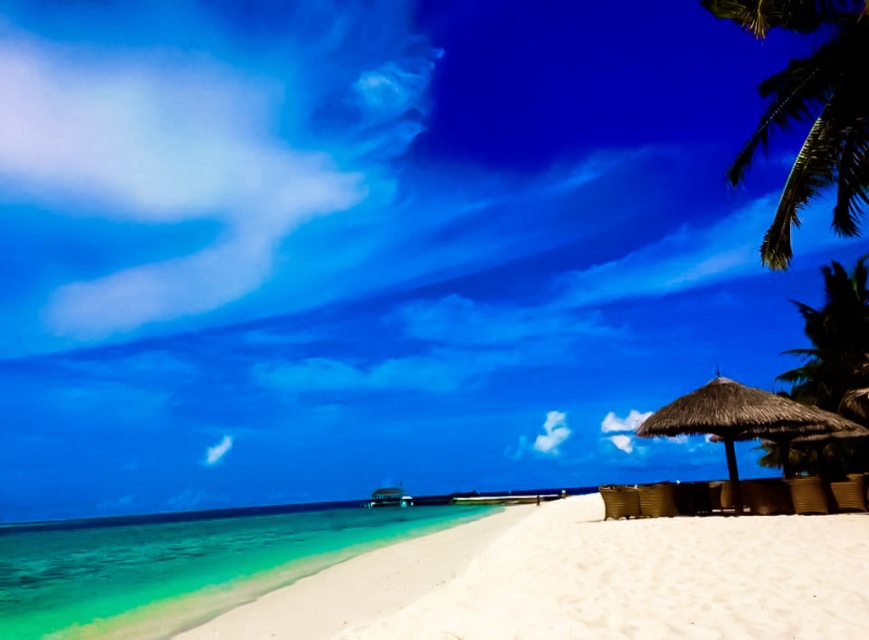
Question: Is green leafy palm tree at upper right closer to the viewer compared to green leafy palm tree at right?

Choices:
 (A) no
 (B) yes

Answer: (B)

Question: Estimate the real-world distances between objects in this image. Which object is closer to the thatched straw umbrella at lower right?

Choices:
 (A) clear water at lower left
 (B) green leafy palm tree at right
 (C) green leafy palm tree at upper right

Answer: (B)

Question: Is clear water at lower left to the left of green leafy palm tree at upper right from the viewer's perspective?

Choices:
 (A) no
 (B) yes

Answer: (B)

Question: Can you confirm if green leafy palm tree at right is thinner than thatched straw umbrella at lower right?

Choices:
 (A) yes
 (B) no

Answer: (A)

Question: Which of the following is the farthest from the observer?

Choices:
 (A) thatched straw umbrella at lower right
 (B) clear water at lower left

Answer: (A)

Question: Which of these objects is positioned closest to the green leafy palm tree at upper right?

Choices:
 (A) thatched straw umbrella at lower right
 (B) green leafy palm tree at right
 (C) clear water at lower left

Answer: (A)